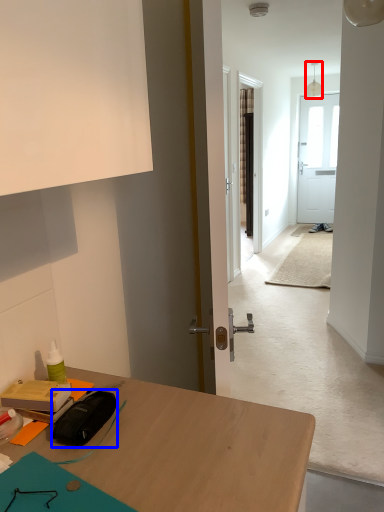
Question: Which object appears closest to the camera in this image, lamp (highlighted by a red box) or stationery (highlighted by a blue box)?

Choices:
 (A) lamp
 (B) stationery

Answer: (B)